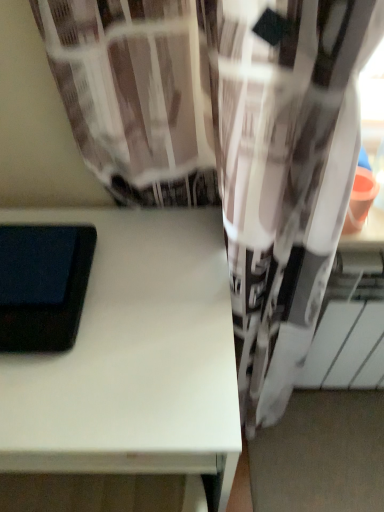
Question: In the image, is black matte tablet at left positioned in front of or behind white matte table at center?

Choices:
 (A) front
 (B) behind

Answer: (B)

Question: Does point (77, 315) appear closer or farther from the camera than point (172, 229)?

Choices:
 (A) farther
 (B) closer

Answer: (B)

Question: Is black matte tablet at left situated inside white matte table at center or outside?

Choices:
 (A) inside
 (B) outside

Answer: (B)

Question: In terms of height, does white matte table at center look taller or shorter compared to black matte tablet at left?

Choices:
 (A) short
 (B) tall

Answer: (B)

Question: From the image's perspective, is white matte table at center located above or below black matte tablet at left?

Choices:
 (A) below
 (B) above

Answer: (A)

Question: Is white matte table at center to the left or to the right of black matte tablet at left in the image?

Choices:
 (A) left
 (B) right

Answer: (B)

Question: From a real-world perspective, is white matte table at center positioned above or below black matte tablet at left?

Choices:
 (A) above
 (B) below

Answer: (B)